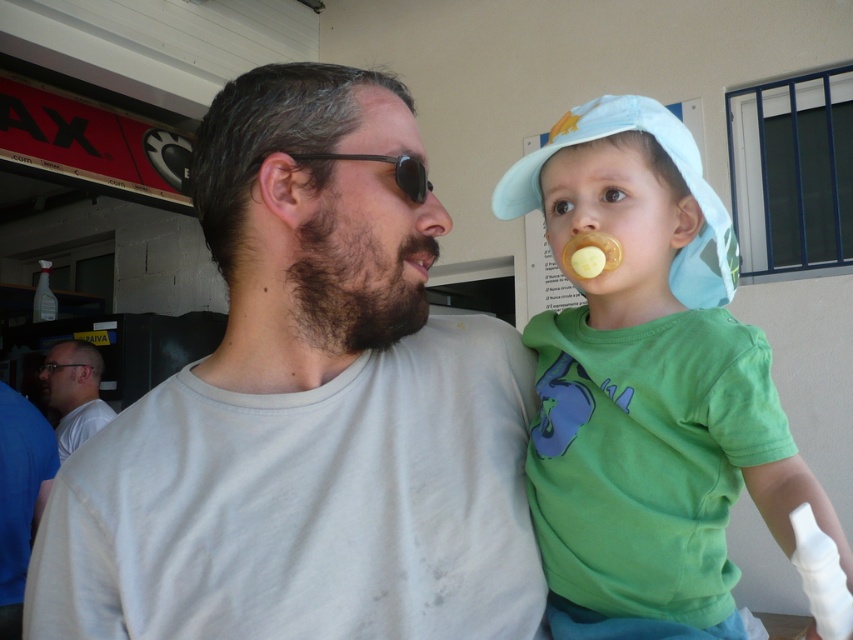
Question: Considering the relative positions of light gray t-shirt at center and white matte shirt at left in the image provided, where is light gray t-shirt at center located with respect to white matte shirt at left?

Choices:
 (A) left
 (B) right

Answer: (B)

Question: Is white matte shirt at left wider than matte brown nose at upper center?

Choices:
 (A) yes
 (B) no

Answer: (A)

Question: Which object appears closest to the camera in this image?

Choices:
 (A) matte brown nose at upper center
 (B) sunglasses at left
 (C) light blue fabric hat at upper right
 (D) light gray t-shirt at center

Answer: (C)

Question: Among these points, which one is farthest from the camera?

Choices:
 (A) (416, 269)
 (B) (363, 326)
 (C) (578, 138)

Answer: (C)

Question: Can you confirm if white matte shirt at left is positioned to the right of matte brown nose at upper center?

Choices:
 (A) no
 (B) yes

Answer: (A)

Question: Which object is the farthest from the white matte shirt at left?

Choices:
 (A) light blue fabric hat at upper right
 (B) beardroughman's face at center
 (C) matte yellow pacifier at upper center

Answer: (C)